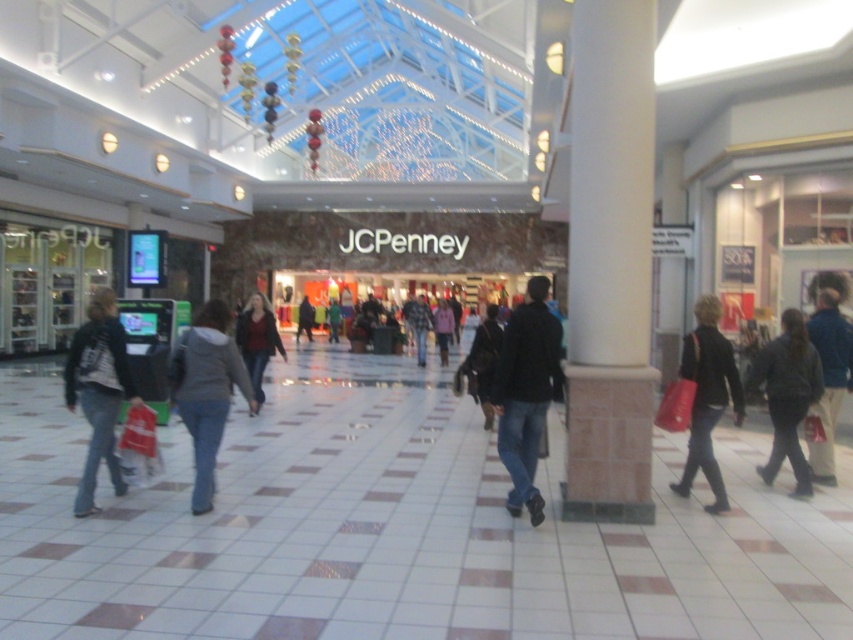
Can you confirm if dark gray jacket at lower right is shorter than green fabric jacket at center?

No.

Identify the location of dark gray jacket at lower right. (787, 396).

The image size is (853, 640). Describe the element at coordinates (787, 396) in the screenshot. I see `dark gray jacket at lower right` at that location.

Where is `dark gray jacket at lower right`? Image resolution: width=853 pixels, height=640 pixels. dark gray jacket at lower right is located at coordinates (787, 396).

Is denim jacket at left smaller than pink fabric jacket at center?

No, denim jacket at left is not smaller than pink fabric jacket at center.

How much distance is there between denim jacket at left and pink fabric jacket at center?

The distance of denim jacket at left from pink fabric jacket at center is 38.86 feet.

Who is more forward, [90,513] or [447,348]?

Point [90,513]

Locate an element on the screen. denim jacket at left is located at coordinates (97, 392).

I want to click on dark gray jacket at right, so click(x=706, y=397).